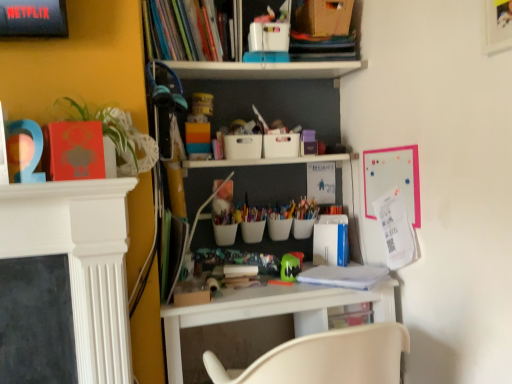
Question: Is white plastic desk at center in front of or behind hardcover books at upper center, which is the second book in right-to-left order, in the image?

Choices:
 (A) behind
 (B) front

Answer: (B)

Question: From the image's perspective, is white plastic desk at center located above or below hardcover books at upper center, which is the second book in right-to-left order?

Choices:
 (A) above
 (B) below

Answer: (B)

Question: Which object is the closest to the green rubber toy at center?

Choices:
 (A) white plastic desk at center
 (B) hardcover books at upper center, which is the second book in right-to-left order
 (C) green leafy plant at left
 (D) white paper at center, the second book from the left

Answer: (D)

Question: Estimate the real-world distances between objects in this image. Which object is farther from the green rubber toy at center?

Choices:
 (A) white plastic desk at center
 (B) white paper at center, the second book from the left
 (C) green leafy plant at left
 (D) hardcover books at upper center, which is the 1th book from top to bottom

Answer: (D)